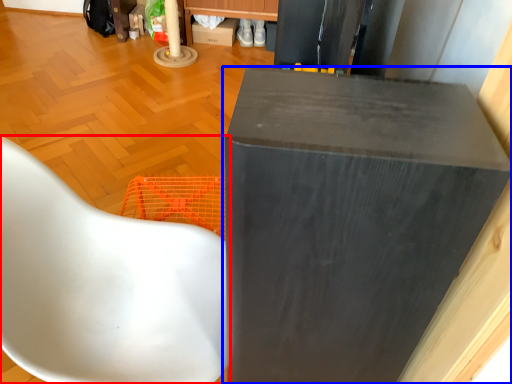
Question: Which object appears closest to the camera in this image, chair (highlighted by a red box) or furniture (highlighted by a blue box)?

Choices:
 (A) chair
 (B) furniture

Answer: (B)